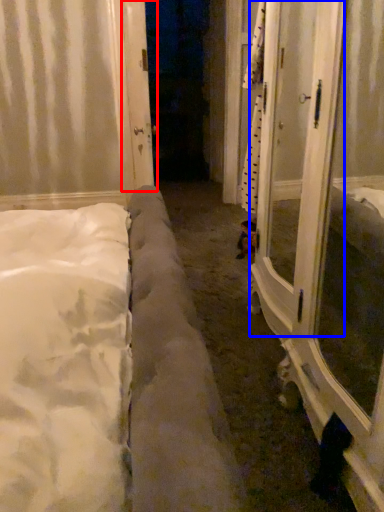
Question: Which point is closer to the camera, door (highlighted by a red box) or screen door (highlighted by a blue box)?

Choices:
 (A) door
 (B) screen door

Answer: (B)